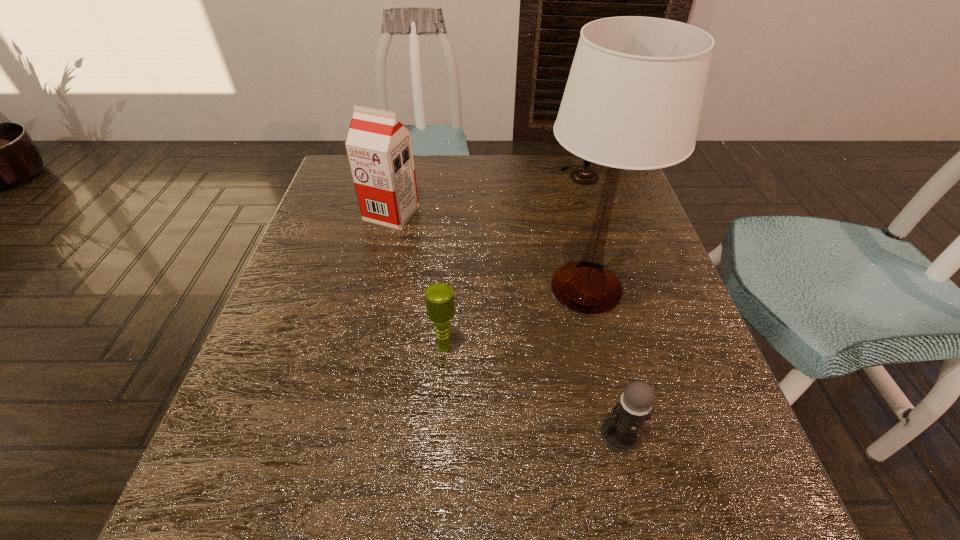
Image resolution: width=960 pixels, height=540 pixels. Find the location of `object that is at the far left corner`. object that is at the far left corner is located at coordinates (379, 147).

Identify the location of object located in the far right corner section of the desktop. Image resolution: width=960 pixels, height=540 pixels. (584, 176).

Find the location of a particular element. The width and height of the screenshot is (960, 540). vacant point at the far edge is located at coordinates (548, 202).

In the image, there is a desktop. At what (x,y) coordinates should I click in order to perform the action: click on vacant space at the near edge. Please return your answer as a coordinate pair (x, y). The image size is (960, 540). Looking at the image, I should click on (411, 478).

Where is `vacant point at the left edge`? vacant point at the left edge is located at coordinates click(301, 326).

The width and height of the screenshot is (960, 540). In the image, there is a desktop. What are the coordinates of `vacant area at the right edge` in the screenshot? It's located at (629, 222).

Find the location of a particular element. vacant space at the near left corner is located at coordinates (258, 534).

Locate an element on the screen. vacant space at the far right corner is located at coordinates (623, 180).

Locate an element on the screen. The width and height of the screenshot is (960, 540). free space between the second tallest object and the third tallest object is located at coordinates (486, 194).

The image size is (960, 540). What are the coordinates of `vacant point located between the leftmost microphone and the third nearest object` in the screenshot? It's located at (516, 317).